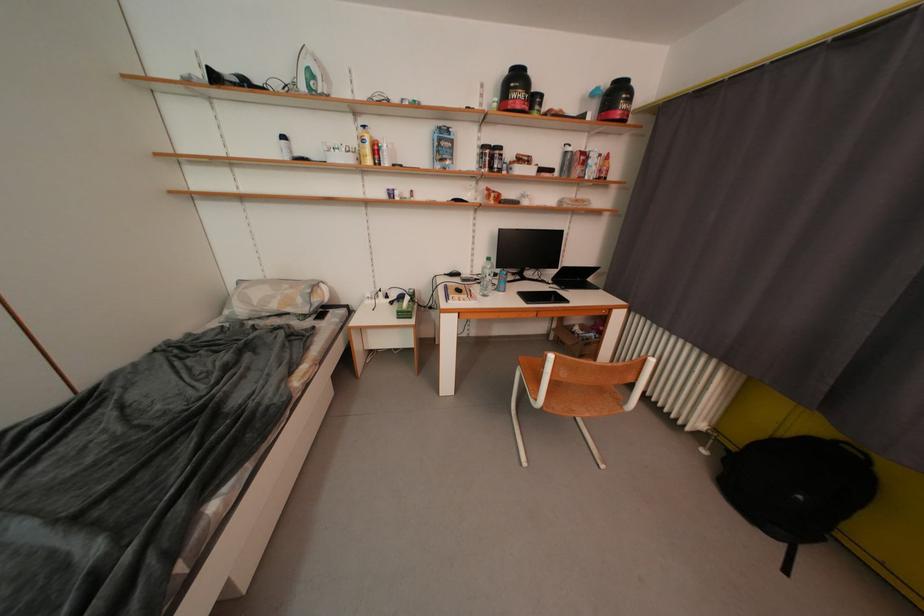
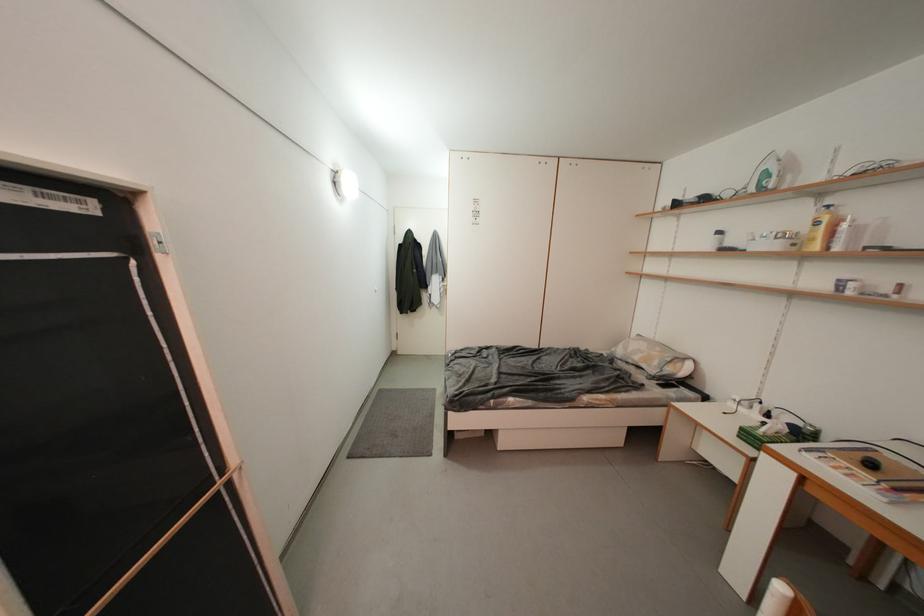
Question: How did the camera likely rotate?

Choices:
 (A) Left
 (B) Right
 (C) Up
 (D) Down

Answer: (A)